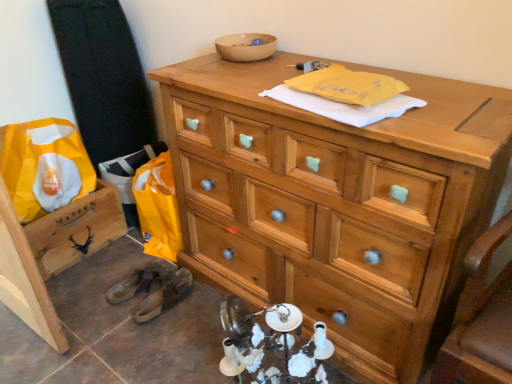
In order to click on free space to the back side of brown leather shoe at lower left, the second shoe in the right-to-left sequence in this screenshot , I will do `click(138, 253)`.